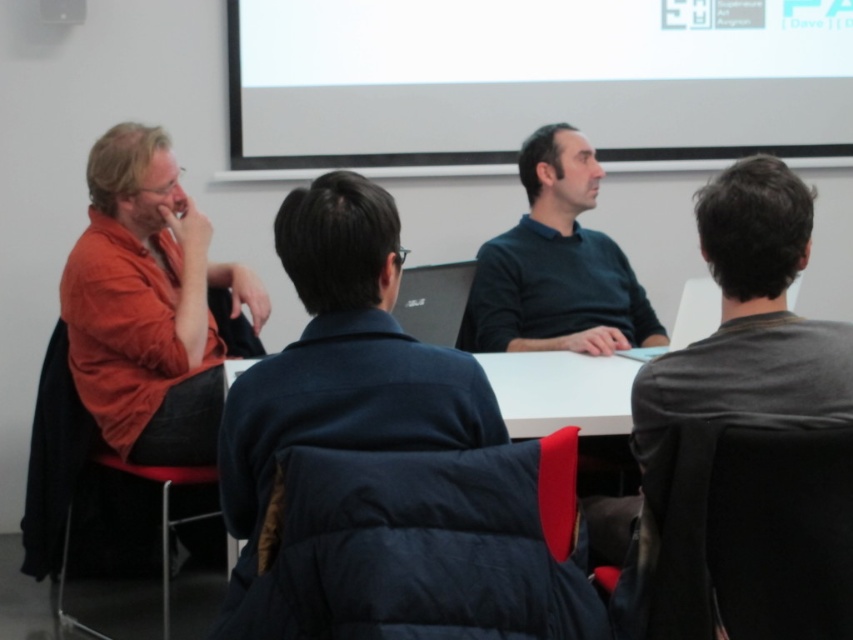
Question: Does dark gray sweater at center have a smaller size compared to dark blue sweater at center?

Choices:
 (A) yes
 (B) no

Answer: (A)

Question: Which object is positioned farthest from the white matte table at center?

Choices:
 (A) dark gray sweater at center
 (B) dark blue sweater at center

Answer: (B)

Question: Which of the following is the farthest from the observer?

Choices:
 (A) (596, 35)
 (B) (85, 392)
 (C) (409, 381)

Answer: (A)

Question: Which object appears farthest from the camera in this image?

Choices:
 (A) dark gray sweater at center
 (B) white matte projection screen at upper center
 (C) dark blue sweater at center

Answer: (B)

Question: Is white matte projection screen at upper center in front of matte orange shirt at left?

Choices:
 (A) no
 (B) yes

Answer: (A)

Question: Is dark blue puffer jacket at center thinner than white matte table at center?

Choices:
 (A) no
 (B) yes

Answer: (B)